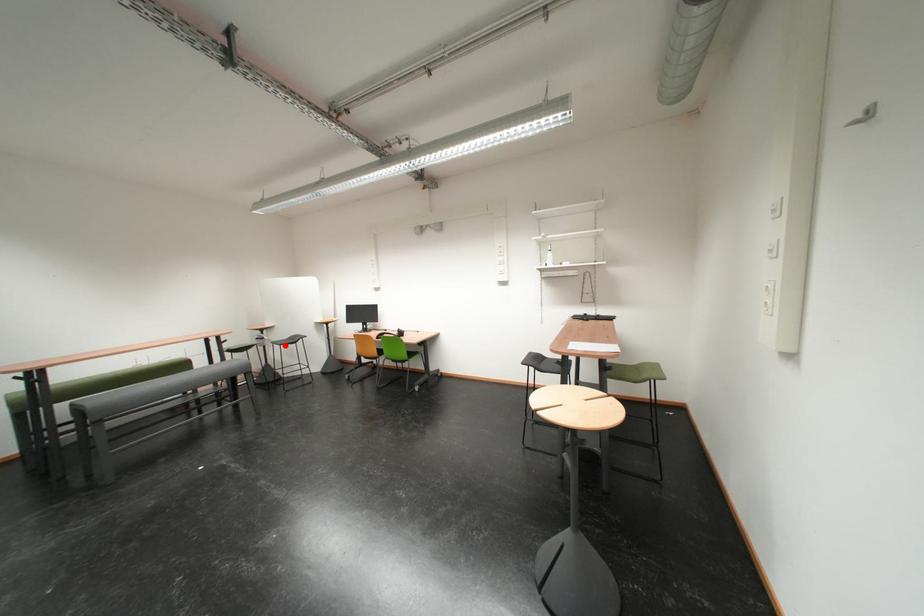
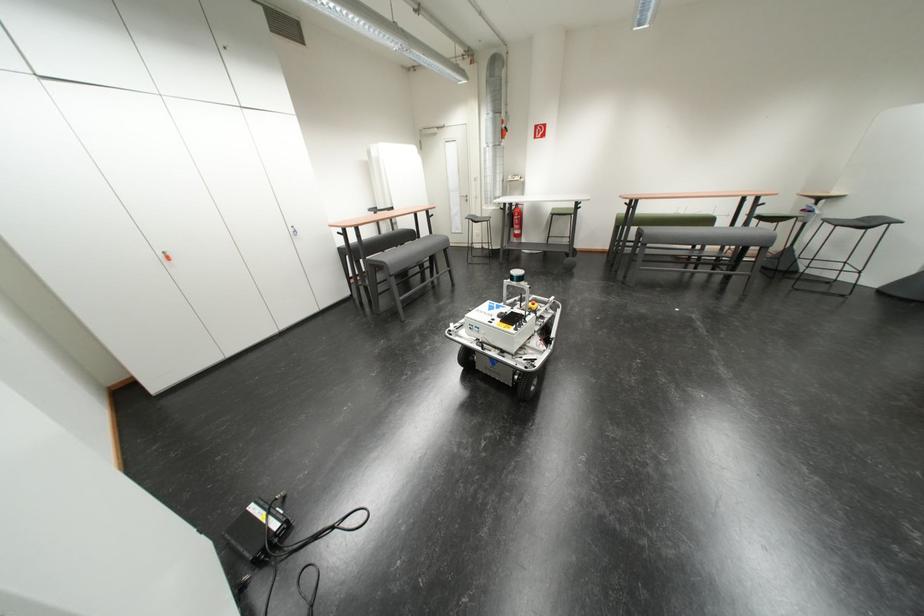
Question: A red point is marked in image1. In image2, is the corresponding 3D point closer to the camera or farther? Reply with the corresponding letter.

Choices:
 (A) The corresponding 3D point is closer.
 (B) The corresponding 3D point is farther.

Answer: (B)